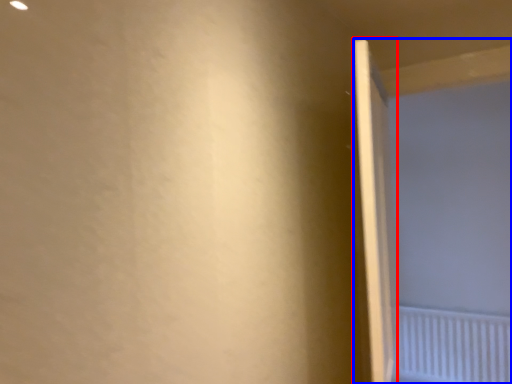
Question: Which object appears farthest to the camera in this image, door (highlighted by a red box) or screen door (highlighted by a blue box)?

Choices:
 (A) door
 (B) screen door

Answer: (B)